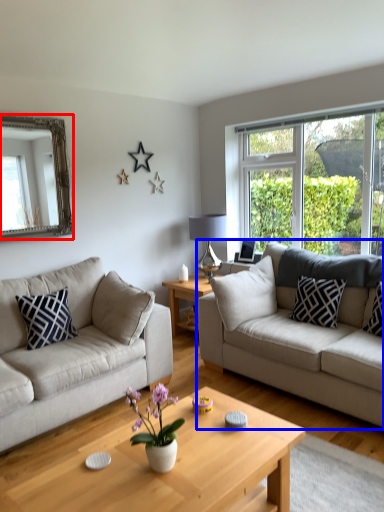
Question: Among these objects, which one is farthest to the camera, mirror (highlighted by a red box) or studio couch (highlighted by a blue box)?

Choices:
 (A) mirror
 (B) studio couch

Answer: (A)